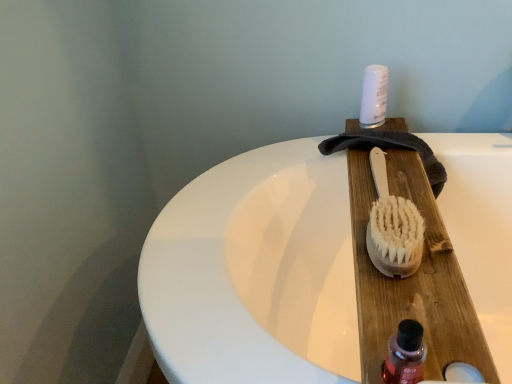
Question: From the image's perspective, is translucent plastic bottle at lower right on top of natural wood brush at center?

Choices:
 (A) yes
 (B) no

Answer: (B)

Question: Does translucent plastic bottle at lower right have a greater height compared to natural wood brush at center?

Choices:
 (A) no
 (B) yes

Answer: (B)

Question: Could you tell me if translucent plastic bottle at lower right is facing natural wood brush at center?

Choices:
 (A) no
 (B) yes

Answer: (A)

Question: Does translucent plastic bottle at lower right have a larger size compared to natural wood brush at center?

Choices:
 (A) no
 (B) yes

Answer: (A)

Question: Does translucent plastic bottle at lower right have a greater width compared to natural wood brush at center?

Choices:
 (A) no
 (B) yes

Answer: (A)

Question: From the image's perspective, is natural wood brush at center located above or below white plastic canister at upper center?

Choices:
 (A) below
 (B) above

Answer: (A)

Question: Relative to white plastic canister at upper center, is natural wood brush at center in front or behind?

Choices:
 (A) front
 (B) behind

Answer: (A)

Question: Is natural wood brush at center wider or thinner than white plastic canister at upper center?

Choices:
 (A) wide
 (B) thin

Answer: (A)

Question: From a real-world perspective, is natural wood brush at center above or below white plastic canister at upper center?

Choices:
 (A) below
 (B) above

Answer: (A)

Question: From their relative heights in the image, would you say white plastic canister at upper center is taller or shorter than translucent plastic bottle at lower right?

Choices:
 (A) short
 (B) tall

Answer: (B)

Question: Would you say white plastic canister at upper center is to the left or to the right of translucent plastic bottle at lower right in the picture?

Choices:
 (A) left
 (B) right

Answer: (B)

Question: Is point (384, 110) positioned closer to the camera than point (408, 334)?

Choices:
 (A) closer
 (B) farther

Answer: (B)

Question: From a real-world perspective, is white plastic canister at upper center positioned above or below translucent plastic bottle at lower right?

Choices:
 (A) above
 (B) below

Answer: (A)

Question: From the image's perspective, is white plastic canister at upper center above or below natural wood brush at center?

Choices:
 (A) above
 (B) below

Answer: (A)

Question: In terms of width, does white plastic canister at upper center look wider or thinner when compared to natural wood brush at center?

Choices:
 (A) wide
 (B) thin

Answer: (B)